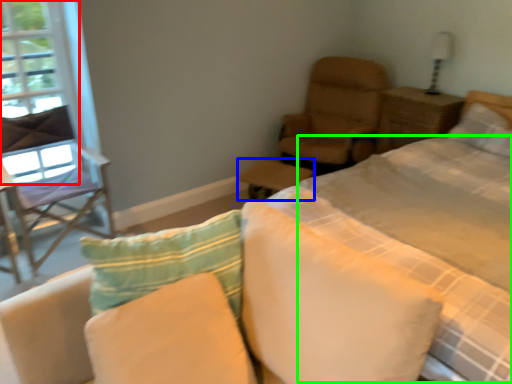
Question: Which is farther away from window screen (highlighted by a red box)? table (highlighted by a blue box) or quilt (highlighted by a green box)?

Choices:
 (A) table
 (B) quilt

Answer: (B)